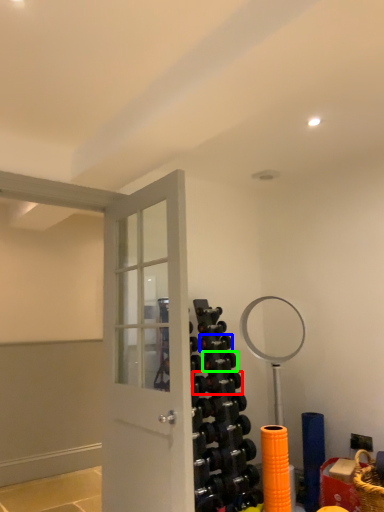
Question: Which is nearer to the dumbbell (highlighted by a red box)? dumbbell (highlighted by a blue box) or dumbbell (highlighted by a green box).

Choices:
 (A) dumbbell
 (B) dumbbell

Answer: (B)